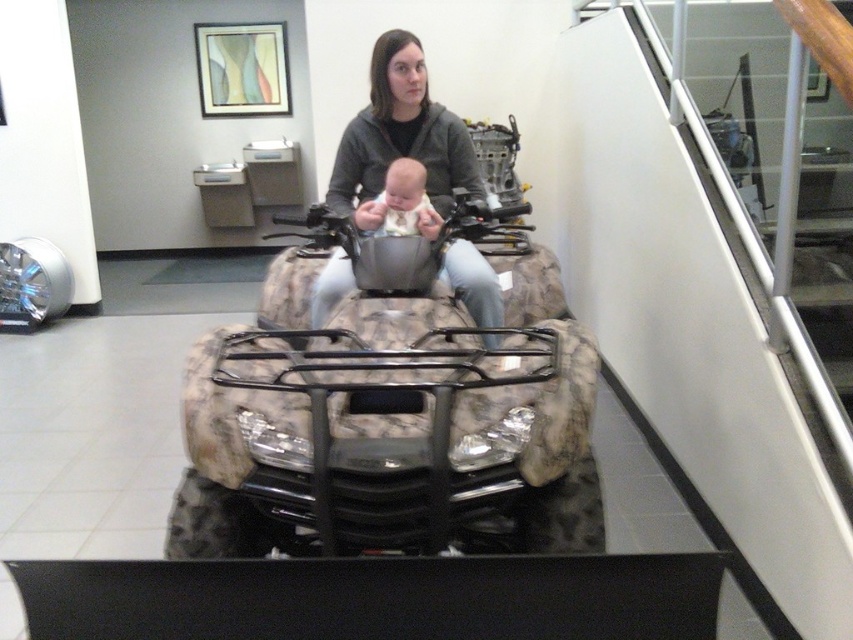
Question: Which of the following is the farthest from the observer?

Choices:
 (A) soft white fabric baby at center
 (B) matte gray hoodie at center
 (C) camouflage fabric baby carriage at center

Answer: (A)

Question: In this image, where is camouflage fabric baby carriage at center located relative to soft white fabric baby at center?

Choices:
 (A) below
 (B) above

Answer: (A)

Question: Which point is farther to the camera?

Choices:
 (A) camouflage fabric baby carriage at center
 (B) soft white fabric baby at center
 (C) matte gray hoodie at center

Answer: (B)

Question: Can you confirm if camouflage fabric baby carriage at center is positioned below soft white fabric baby at center?

Choices:
 (A) no
 (B) yes

Answer: (B)

Question: Does camouflage fabric baby carriage at center lie behind matte gray hoodie at center?

Choices:
 (A) no
 (B) yes

Answer: (A)

Question: Which point is farther to the camera?

Choices:
 (A) camouflage fabric baby carriage at center
 (B) matte gray hoodie at center

Answer: (B)